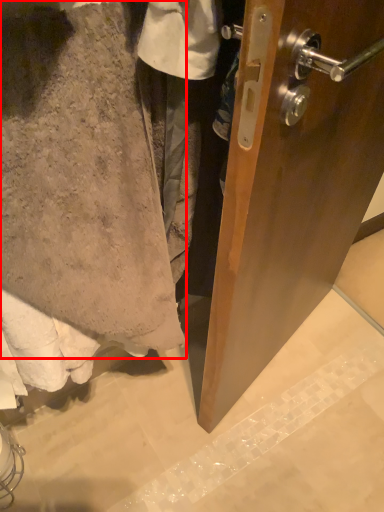
Question: From the image's perspective, where is towel (annotated by the red box) located in relation to concrete in the image?

Choices:
 (A) above
 (B) below

Answer: (A)